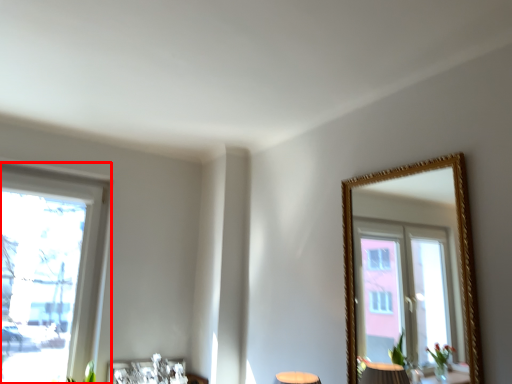
Question: In this image, where is window (annotated by the red box) located relative to picture frame?

Choices:
 (A) right
 (B) left

Answer: (B)